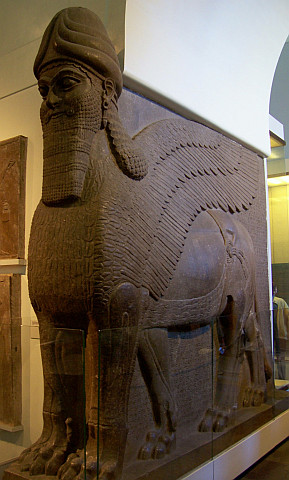
Locate an element on the screen. plinth is located at coordinates (231, 450).